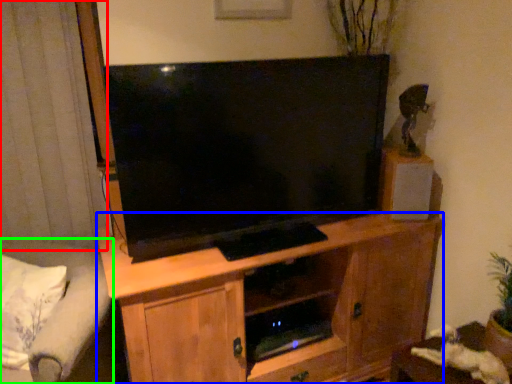
Question: Estimate the real-world distances between objects in this image. Which object is closer to curtain (highlighted by a red box), cabinetry (highlighted by a blue box) or studio couch (highlighted by a green box)?

Choices:
 (A) cabinetry
 (B) studio couch

Answer: (B)